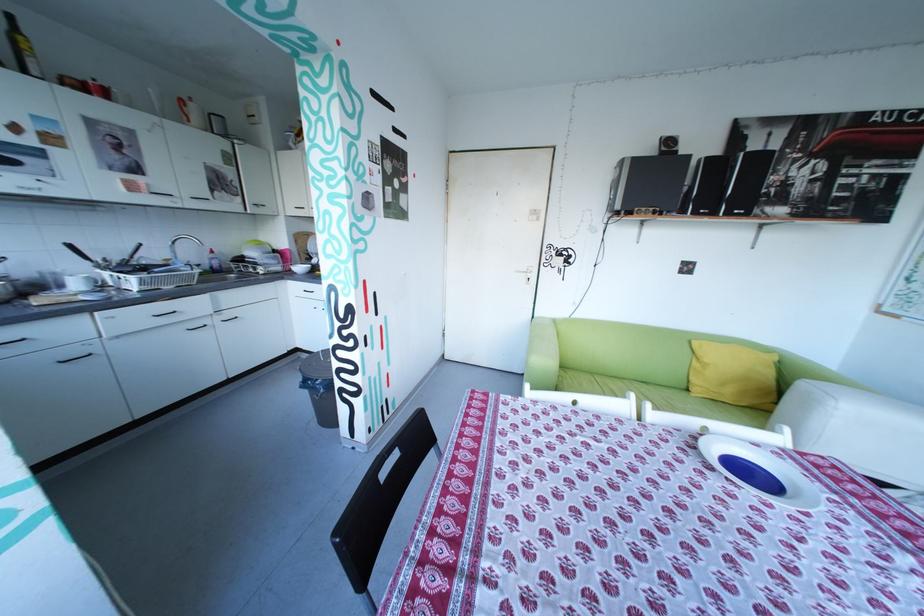
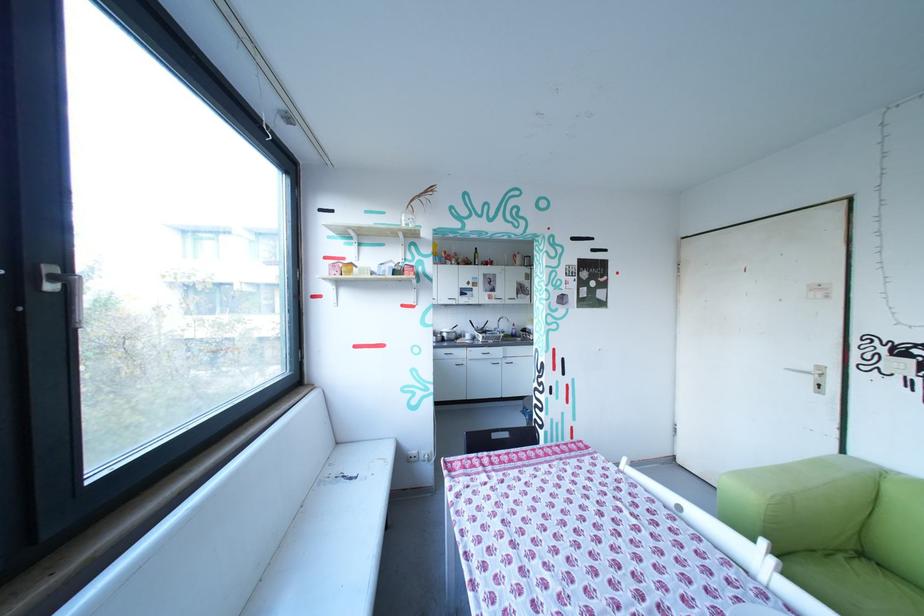
In the second image, find the point that corresponds to point 661,405 in the first image.

(785, 562)